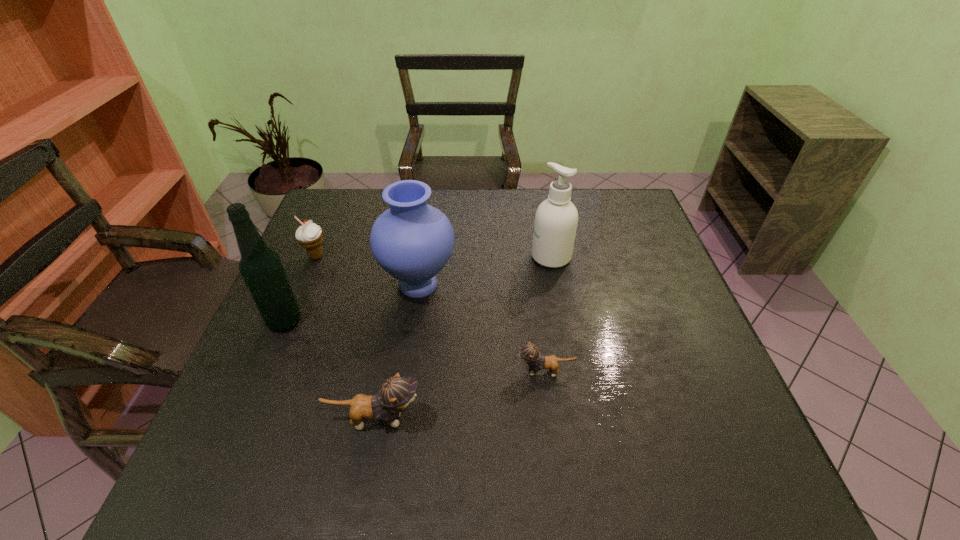
Where is `vacant space that's between the cleansing agent and the nearest object`? vacant space that's between the cleansing agent and the nearest object is located at coordinates (463, 339).

This screenshot has width=960, height=540. What are the coordinates of `vacant space that's between the icecream and the vase` in the screenshot? It's located at (368, 271).

Locate an element on the screen. Image resolution: width=960 pixels, height=540 pixels. vacant area that lies between the vase and the nearest object is located at coordinates (396, 352).

Identify the location of unoccupied area between the vase and the icecream. (368, 271).

Find the location of a particular element. This screenshot has width=960, height=540. empty space between the cleansing agent and the taller kitten is located at coordinates (463, 339).

Locate which object ranks fifth in proximity to the alcohol. Please provide its 2D coordinates. Your answer should be formatted as a tuple, i.e. [(x, y)], where the tuple contains the x and y coordinates of a point satisfying the conditions above.

[(556, 219)]

The height and width of the screenshot is (540, 960). I want to click on object that can be found as the fourth closest to the cleansing agent, so click(309, 235).

Image resolution: width=960 pixels, height=540 pixels. I want to click on vacant point that satisfies the following two spatial constraints: 1. on the front side of the vase; 2. on the left side of the icecream, so click(x=304, y=285).